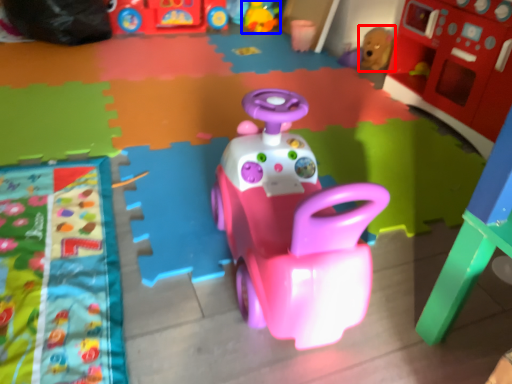
Question: Which object is further to the camera taking this photo, toy (highlighted by a red box) or toy (highlighted by a blue box)?

Choices:
 (A) toy
 (B) toy

Answer: (B)